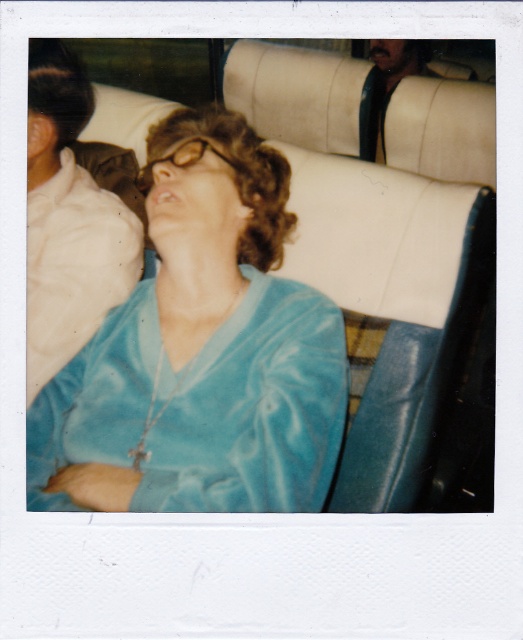
Question: Can you confirm if satin blue robe at center is smaller than leather at upper right?

Choices:
 (A) yes
 (B) no

Answer: (A)

Question: Is velvet blue blouse at center to the left of satin blue robe at center from the viewer's perspective?

Choices:
 (A) no
 (B) yes

Answer: (A)

Question: Which object appears closest to the camera in this image?

Choices:
 (A) satin blue robe at center
 (B) leather at upper right
 (C) velvet blue blouse at center

Answer: (C)

Question: Does velvet blue blouse at center appear over satin blue robe at center?

Choices:
 (A) yes
 (B) no

Answer: (B)

Question: Which object appears farthest from the camera in this image?

Choices:
 (A) velvet blue blouse at center
 (B) satin blue robe at center

Answer: (B)

Question: Among these objects, which one is farthest from the camera?

Choices:
 (A) leather at upper right
 (B) velvet blue blouse at center
 (C) satin blue robe at center

Answer: (A)